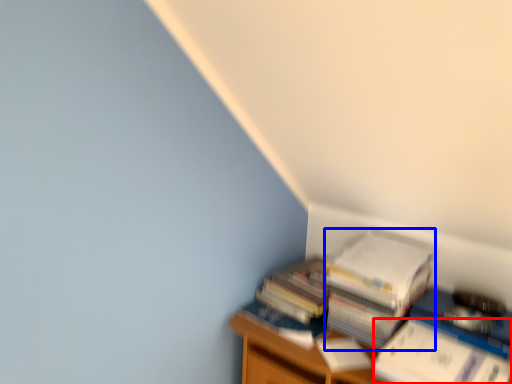
Question: Among these objects, which one is nearest to the camera, paperback book (highlighted by a red box) or paperback book (highlighted by a blue box)?

Choices:
 (A) paperback book
 (B) paperback book

Answer: (A)